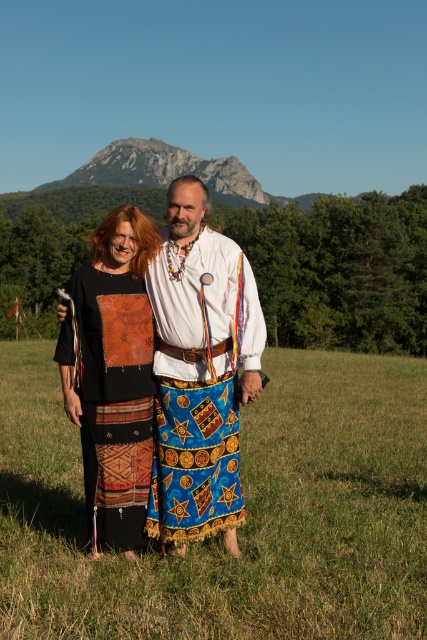
You are a photographer trying to capture a clear photo of the leather patchwork dress at center. However, the blue printed skirt at center is blocking your view. Can you adjust your position to take the photo without moving the subjects?

The blue printed skirt at center is in front of the leather patchwork dress at center, so you can move your camera position to the side or angle it so that the skirt no longer blocks the dress.

You are a photographer setting up for a photoshoot in the grassy field. You need to position two models wearing the blue printed skirt at center and the leather patchwork dress at center exactly 18 inches apart. Based on their current positions, do you need to move them closer or farther apart?

The blue printed skirt at center is currently 16.30 inches away from the leather patchwork dress at center. Since the desired distance is 18 inches, you need to move them farther apart to reach the required distance.